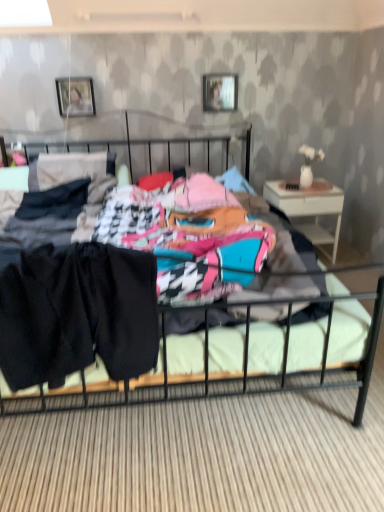
Question: Is metallic silver picture frame at upper center, which is the 2th picture frame from left to right, not within black fabric shorts at center?

Choices:
 (A) yes
 (B) no

Answer: (A)

Question: From the image's perspective, is metallic silver picture frame at upper center, the 1th picture frame from the right, over black fabric shorts at center?

Choices:
 (A) yes
 (B) no

Answer: (A)

Question: Can you confirm if metallic silver picture frame at upper center, the 1th picture frame from the right, is thinner than black fabric shorts at center?

Choices:
 (A) no
 (B) yes

Answer: (B)

Question: Is metallic silver picture frame at upper center, which is the 2th picture frame from left to right, at the left side of black fabric shorts at center?

Choices:
 (A) no
 (B) yes

Answer: (A)

Question: Considering the relative positions of metallic silver picture frame at upper center, which is the 2th picture frame from left to right, and black fabric shorts at center in the image provided, is metallic silver picture frame at upper center, which is the 2th picture frame from left to right, in front of black fabric shorts at center?

Choices:
 (A) no
 (B) yes

Answer: (A)

Question: In terms of size, does black fabric shorts at center appear bigger or smaller than matte silver picture frame at upper center, the 2th picture frame viewed from the right?

Choices:
 (A) big
 (B) small

Answer: (A)

Question: Is black fabric shorts at center situated inside matte silver picture frame at upper center, positioned as the first picture frame in left-to-right order, or outside?

Choices:
 (A) outside
 (B) inside

Answer: (A)

Question: Is black fabric shorts at center wider or thinner than matte silver picture frame at upper center, positioned as the first picture frame in left-to-right order?

Choices:
 (A) thin
 (B) wide

Answer: (B)

Question: Does point (59, 384) appear closer or farther from the camera than point (61, 105)?

Choices:
 (A) farther
 (B) closer

Answer: (B)

Question: Is metallic silver picture frame at upper center, the 1th picture frame from the right, bigger or smaller than black fabric shorts at center?

Choices:
 (A) small
 (B) big

Answer: (A)

Question: From the image's perspective, is metallic silver picture frame at upper center, which is the 2th picture frame from left to right, located above or below black fabric shorts at center?

Choices:
 (A) above
 (B) below

Answer: (A)

Question: From a real-world perspective, is metallic silver picture frame at upper center, the 1th picture frame from the right, physically located above or below black fabric shorts at center?

Choices:
 (A) below
 (B) above

Answer: (B)

Question: Considering the positions of metallic silver picture frame at upper center, which is the 2th picture frame from left to right, and black fabric shorts at center in the image, is metallic silver picture frame at upper center, which is the 2th picture frame from left to right, taller or shorter than black fabric shorts at center?

Choices:
 (A) short
 (B) tall

Answer: (A)

Question: Is black fabric shorts at center bigger or smaller than metallic silver picture frame at upper center, the 1th picture frame from the right?

Choices:
 (A) big
 (B) small

Answer: (A)

Question: Is black fabric shorts at center taller or shorter than metallic silver picture frame at upper center, the 1th picture frame from the right?

Choices:
 (A) short
 (B) tall

Answer: (B)